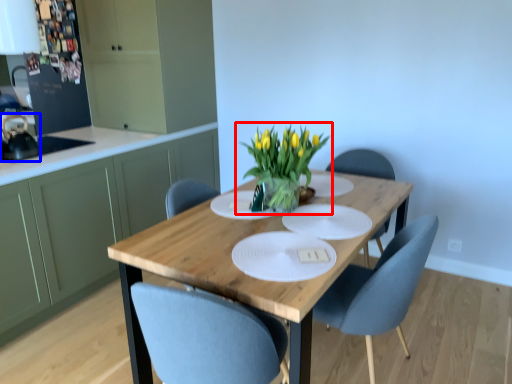
Question: Among these objects, which one is nearest to the camera, houseplant (highlighted by a red box) or appliance (highlighted by a blue box)?

Choices:
 (A) houseplant
 (B) appliance

Answer: (A)